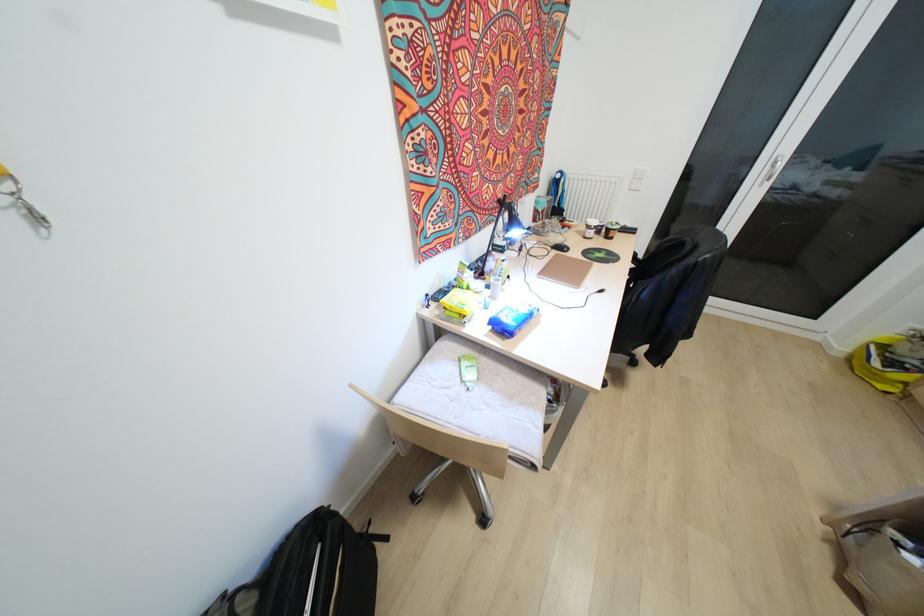
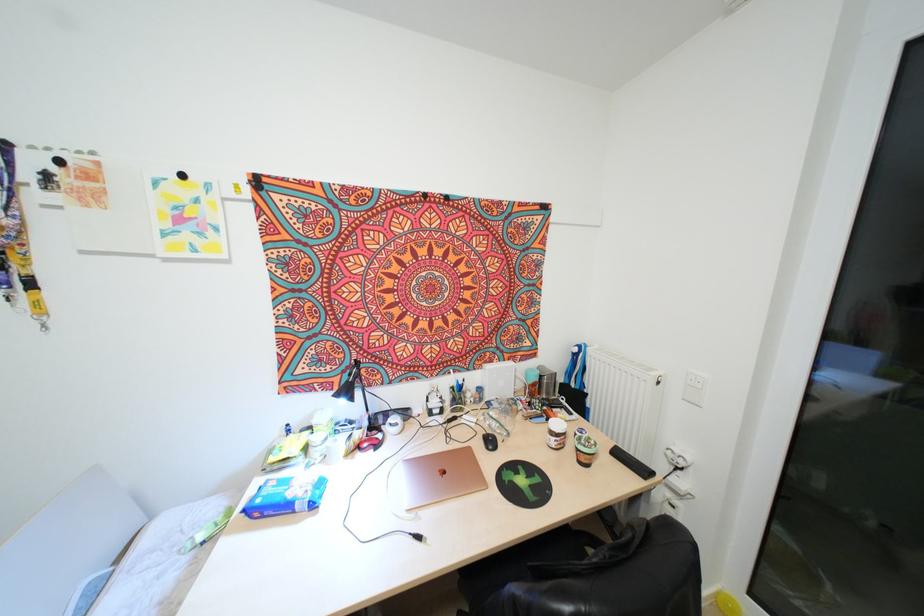
The point at [631,230] is marked in the first image. Where is the corresponding point in the second image?

(642, 471)